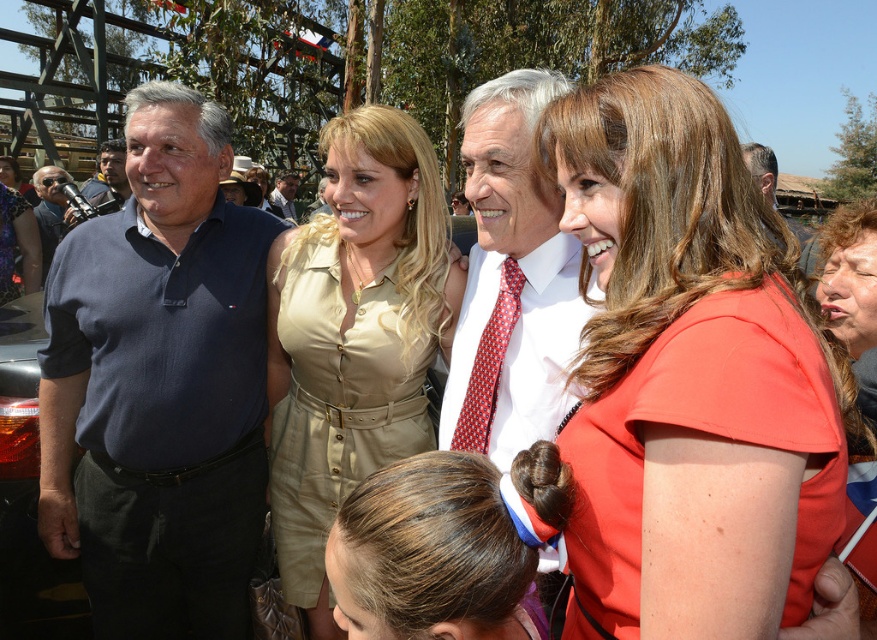
Can you confirm if orange matte dress at right is smaller than beige fabric dress at center?

Indeed, orange matte dress at right has a smaller size compared to beige fabric dress at center.

Is orange matte dress at right bigger than beige fabric dress at center?

Incorrect, orange matte dress at right is not larger than beige fabric dress at center.

Image resolution: width=877 pixels, height=640 pixels. I want to click on orange matte dress at right, so click(x=689, y=376).

The image size is (877, 640). Identify the location of orange matte dress at right. (689, 376).

Can you confirm if orange matte dress at right is positioned to the left of white shirt with red tie at center?

No, orange matte dress at right is not to the left of white shirt with red tie at center.

Does orange matte dress at right appear over white shirt with red tie at center?

No, orange matte dress at right is not above white shirt with red tie at center.

Between point (794, 266) and point (505, 308), which one is positioned in front?

Point (794, 266) is more forward.

At what (x,y) coordinates should I click in order to perform the action: click on orange matte dress at right. Please return your answer as a coordinate pair (x, y). The image size is (877, 640). Looking at the image, I should click on coord(689,376).

Is white shirt with red tie at center wider than red dotted tie at center?

Indeed, white shirt with red tie at center has a greater width compared to red dotted tie at center.

Is point (544, 413) closer to viewer compared to point (481, 436)?

Yes, it is in front of point (481, 436).

Find the location of `white shirt with red tie at center`. white shirt with red tie at center is located at coordinates (511, 280).